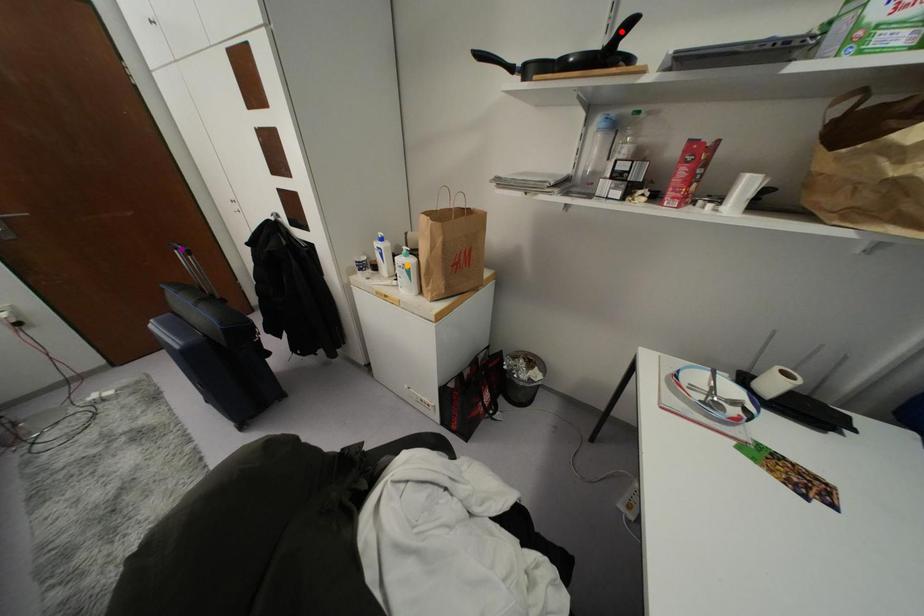
Consider the image. Order these from nearest to farthest:
- orange point
- purple point
- red point

purple point, orange point, red point